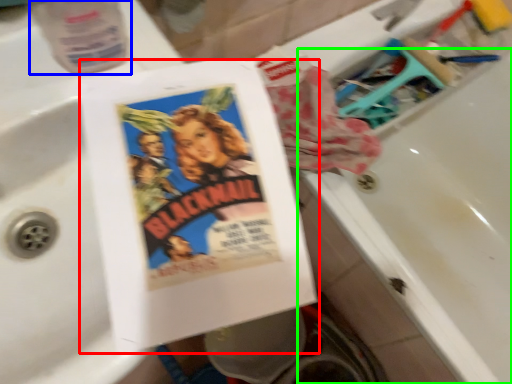
Question: Based on their relative distances, which object is farther from paperback book (highlighted by a red box)? Choose from bottle (highlighted by a blue box) and bath (highlighted by a green box).

Choices:
 (A) bottle
 (B) bath

Answer: (B)